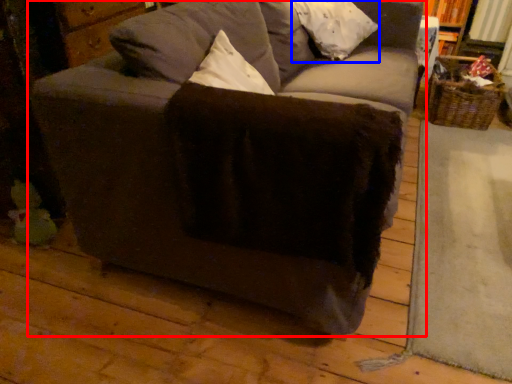
Question: Among these objects, which one is nearest to the camera, studio couch (highlighted by a red box) or pillow (highlighted by a blue box)?

Choices:
 (A) studio couch
 (B) pillow

Answer: (A)